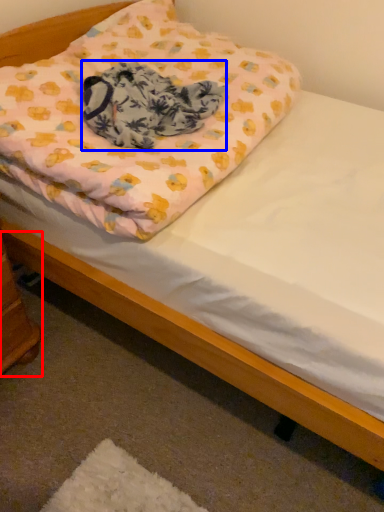
Question: Which object is closer to the camera taking this photo, changing table (highlighted by a red box) or blanket (highlighted by a blue box)?

Choices:
 (A) changing table
 (B) blanket

Answer: (A)